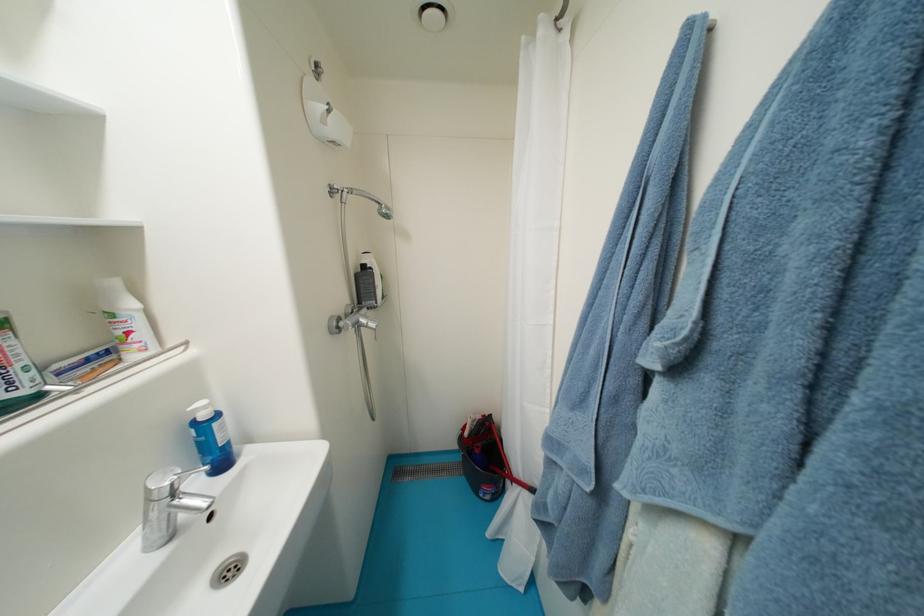
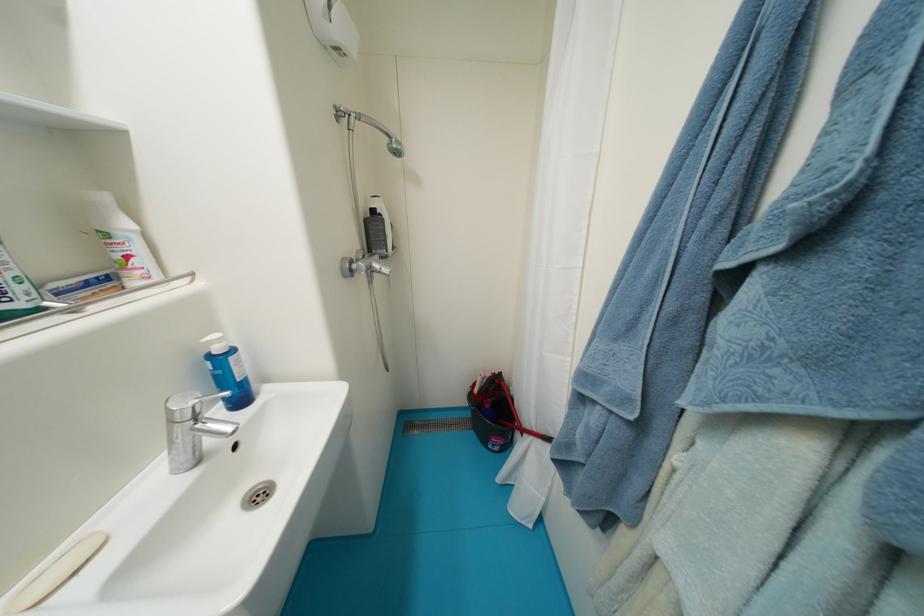
The point at (x=213, y=408) is marked in the first image. Where is the corresponding point in the second image?

(225, 342)